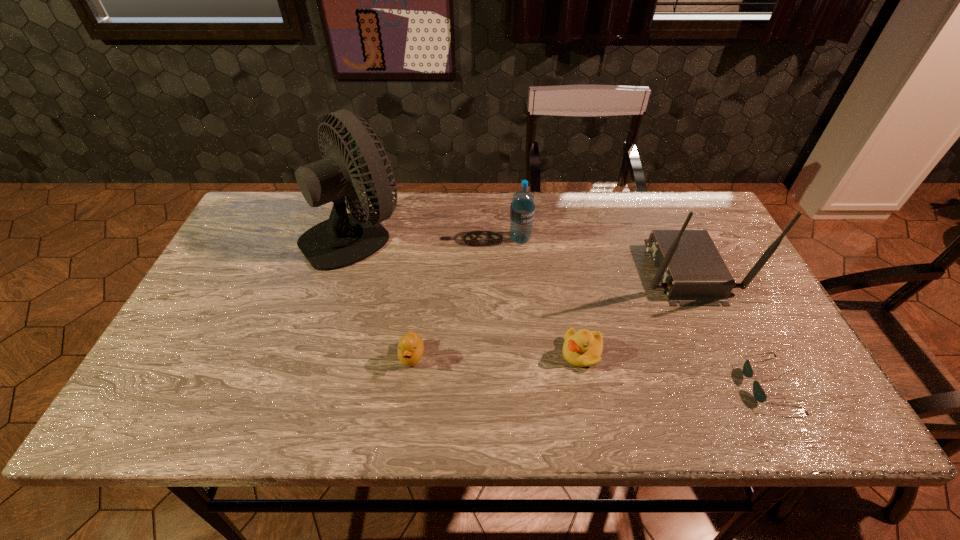
Where is `fan located at the far edge`? fan located at the far edge is located at coordinates (344, 239).

This screenshot has width=960, height=540. I want to click on router that is at the far edge, so click(x=693, y=273).

I want to click on water bottle at the far edge, so click(522, 209).

The width and height of the screenshot is (960, 540). What are the coordinates of `object positioned at the near edge` in the screenshot? It's located at (759, 394).

The height and width of the screenshot is (540, 960). I want to click on router present at the right edge, so (x=693, y=273).

Identify the location of sunglasses present at the right edge. This screenshot has height=540, width=960. (759, 394).

In order to click on object at the far right corner in this screenshot , I will do `click(693, 273)`.

The height and width of the screenshot is (540, 960). In order to click on object that is at the near right corner in this screenshot , I will do `click(759, 394)`.

Locate an element on the screen. vacant area at the far edge of the desktop is located at coordinates (433, 205).

I want to click on vacant space at the near edge of the desktop, so click(x=701, y=409).